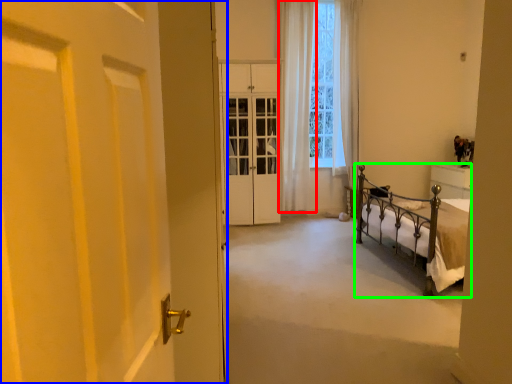
Question: Based on their relative distances, which object is nearer to curtain (highlighted by a red box)? Choose from door (highlighted by a blue box) and bed (highlighted by a green box).

Choices:
 (A) door
 (B) bed

Answer: (B)